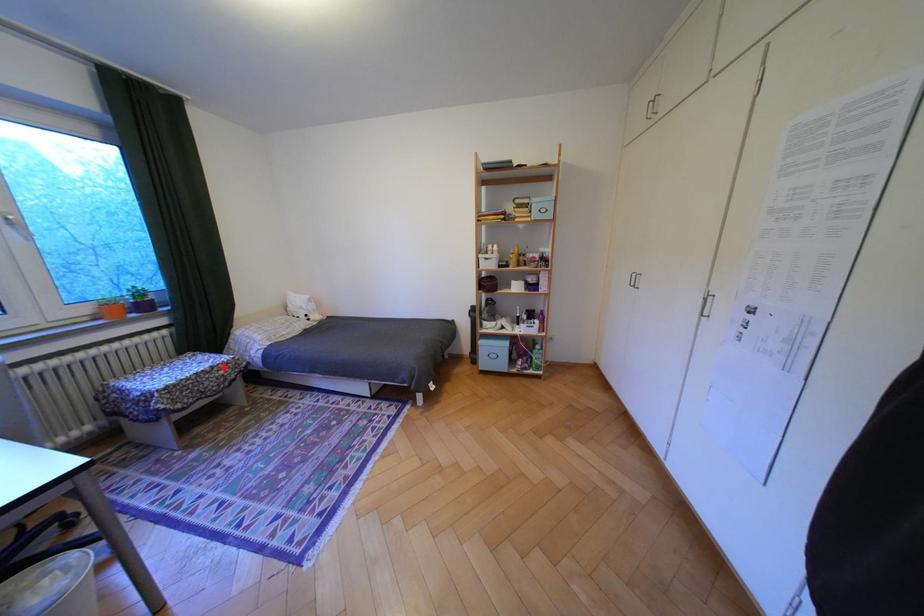
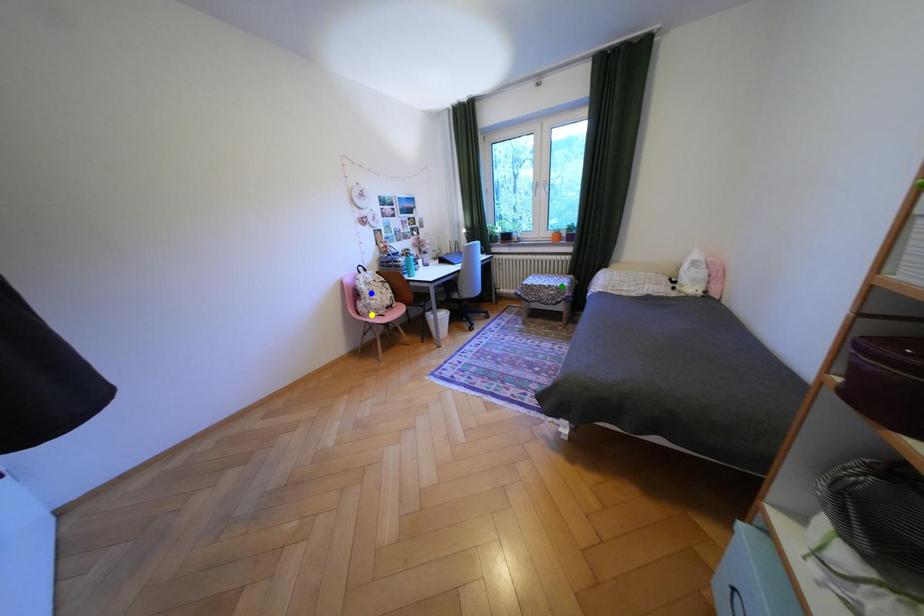
Question: I am providing you with two images of the same scene from different viewpoints. A red point is marked on the first image. You are given multiple points on the second image. In image 2, which mark is for the same physical point as the one in image 1?

Choices:
 (A) green point
 (B) blue point
 (C) yellow point

Answer: (A)